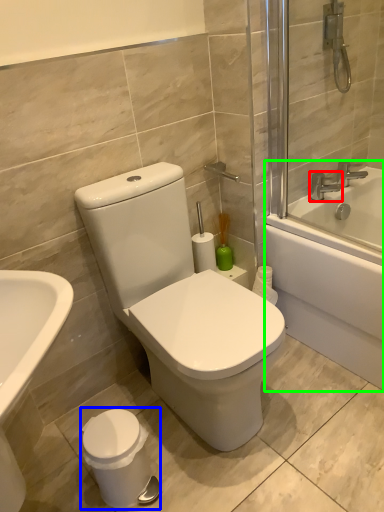
Question: Which object is positioned closest to tap (highlighted by a red box)? Select from porcelain (highlighted by a blue box) and bathtub (highlighted by a green box).

Choices:
 (A) porcelain
 (B) bathtub

Answer: (B)